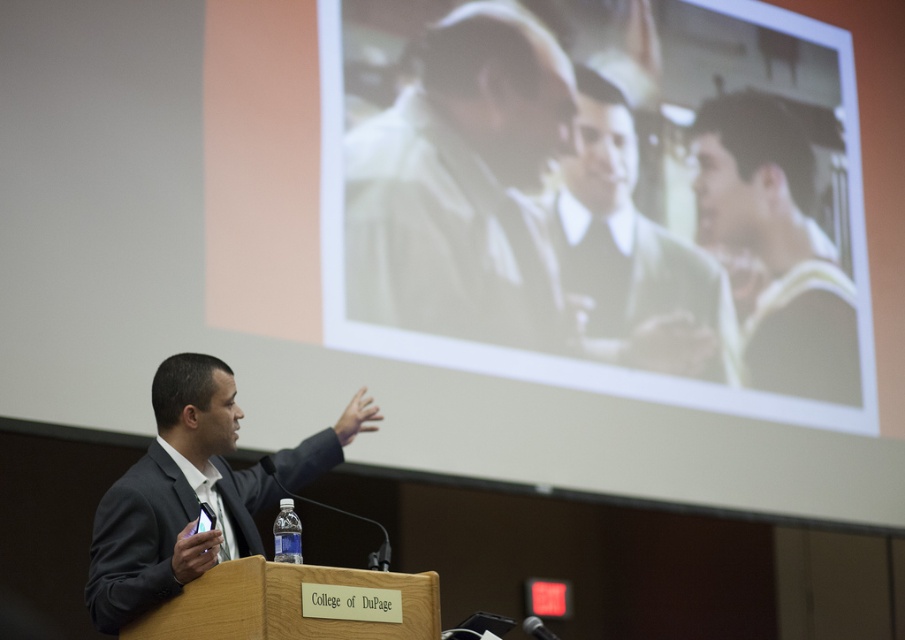
Can you confirm if light beige fabric shirt at center is smaller than light beige suit at center?

Incorrect, light beige fabric shirt at center is not smaller in size than light beige suit at center.

Is light beige fabric shirt at center in front of light beige suit at center?

Yes, light beige fabric shirt at center is closer to the viewer.

Does point (372, 200) come farther from viewer compared to point (614, 324)?

No.

At what (x,y) coordinates should I click in order to perform the action: click on light beige fabric shirt at center. Please return your answer as a coordinate pair (x, y). This screenshot has width=905, height=640. Looking at the image, I should click on (462, 186).

Describe the element at coordinates (462, 186) in the screenshot. I see `light beige fabric shirt at center` at that location.

Who is lower down, light beige fabric shirt at center or dark gray suit at center?

Positioned lower is dark gray suit at center.

Does point (513, 344) come behind point (179, 438)?

Yes, it is.

Where is `light beige fabric shirt at center`? The height and width of the screenshot is (640, 905). light beige fabric shirt at center is located at coordinates (462, 186).

Which is more to the left, matte white screen at upper center or light beige suit at center?

From the viewer's perspective, matte white screen at upper center appears more on the left side.

Does matte white screen at upper center have a lesser width compared to light beige suit at center?

No.

Locate an element on the screen. This screenshot has height=640, width=905. matte white screen at upper center is located at coordinates (602, 198).

Identify the location of matte white screen at upper center. (602, 198).